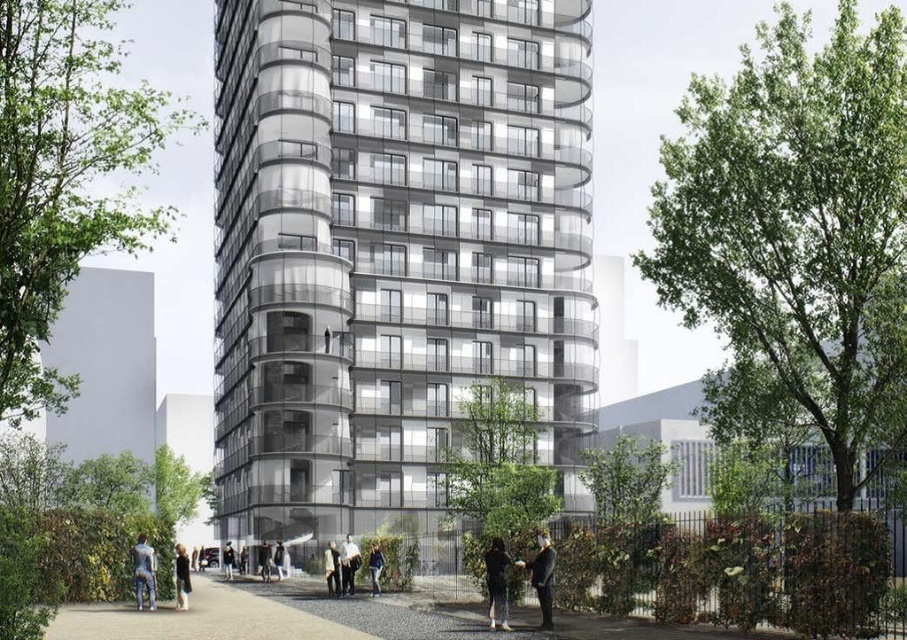
Question: Can you confirm if dark gray fabric jacket at lower left is smaller than light brown leather jacket at center?

Choices:
 (A) yes
 (B) no

Answer: (B)

Question: Which object is closer to the camera taking this photo?

Choices:
 (A) light brown leather jacket at lower center
 (B) dark gray fabric jacket at lower left

Answer: (B)

Question: Is light brown leather jacket at lower left wider than light brown leather jacket at center?

Choices:
 (A) no
 (B) yes

Answer: (B)

Question: Considering the real-world distances, which object is closest to the light brown leather jacket at lower center?

Choices:
 (A) dark gray fabric jacket at lower left
 (B) white cotton shirt at center
 (C) dark gray fabric coat at lower center

Answer: (B)

Question: Can you confirm if dark gray fabric coat at lower center is bigger than light brown leather jacket at center?

Choices:
 (A) no
 (B) yes

Answer: (B)

Question: Considering the real-world distances, which object is farthest from the light brown leather jacket at lower center?

Choices:
 (A) white cotton shirt at center
 (B) light brown leather jacket at lower left
 (C) dark gray fabric jacket at lower center
 (D) transparent glass building at center

Answer: (C)